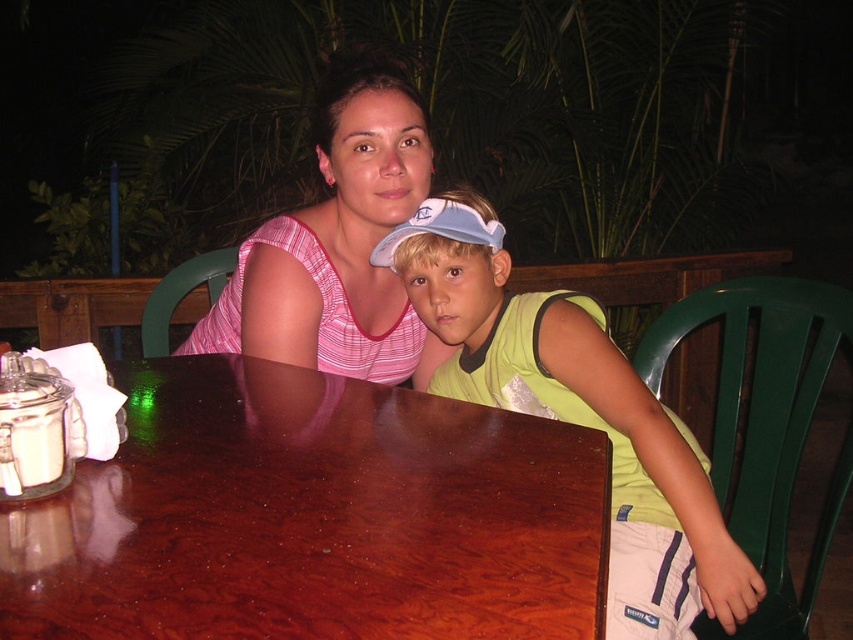
You are a delivery person who needs to place a small package on the mahogany wood table at center. The package requires 12 inches of space. Considering the green fabric shirt at center is currently occupying space near the table, will there be enough space to place the package?

The mahogany wood table at center and green fabric shirt at center are 13.20 inches apart. Since the required space is 12 inches, there is enough space to place the package as the distance between them is sufficient.

Consider the image. You are a waiter at a restaurant and need to place a 40 cm wide dessert plate on the mahogany wood table at center. Can you fit it without overlapping the pink striped tank top at center?

The mahogany wood table at center is 39.92 centimeters away from the pink striped tank top at center. Since the distance is less than 40 cm, placing a 40 cm wide dessert plate might cause it to overlap the pink striped tank top at center. Therefore, it may not fit without overlapping.

You are a photographer trying to capture a clear shot of the mahogany wood table at center and the pink striped tank top at center. Since you want both subjects in focus, which one should you adjust your camera focus on first to ensure both are sharp?

The mahogany wood table at center is closer to the viewer than the pink striped tank top at center. To ensure both are in focus, you should focus on the pink striped tank top at center first, as it is farther away, allowing the depth of field to cover the closer table.